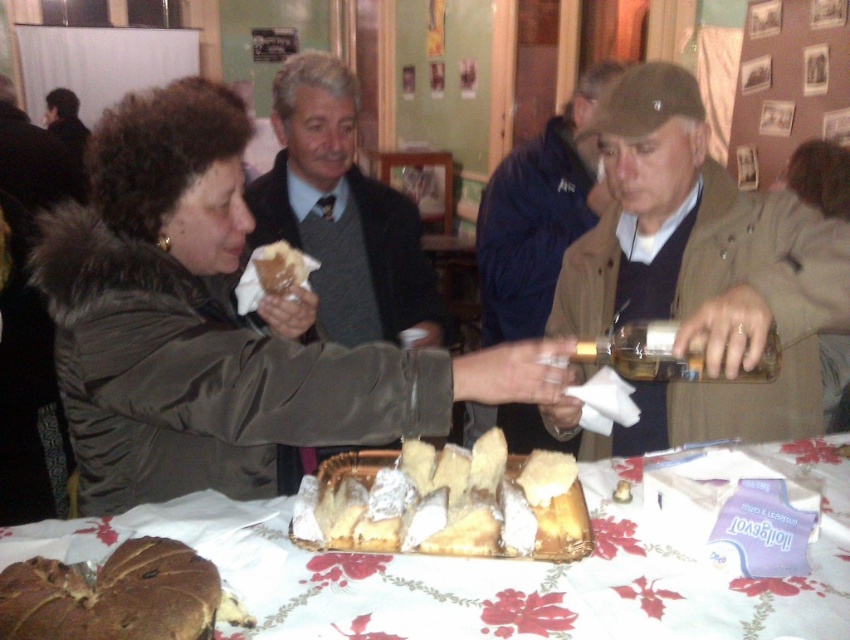
You are a guest at this event and want to reach for the translucent glass bottle at center without moving the brown crumbly pastry at lower left. Is this possible?

The brown crumbly pastry at lower left is in front of the translucent glass bottle at center, so you can reach the translucent glass bottle at center without moving the pastry by accessing it from behind.

You are at the point marked as point (140, 582) and want to walk towards the point marked as point (629, 368). Will you be moving away from the table covered by a white tablecloth with red floral patterns?

Point (140, 582) is in front of point (629, 368), so moving towards point (629, 368) would mean moving away from the table covered by a white tablecloth with red floral patterns.

You are a photographer standing at the back of the room. You want to take a photo of the matte green jacket at left and the white floral tablecloth at lower center so that both are clearly visible in the frame. Given their distance apart, is this possible?

The matte green jacket at left and the white floral tablecloth at lower center are 24.16 centimeters apart from each other. Since they are relatively close, it should be possible to capture both in a single frame as long as the camera is positioned appropriately to include both elements within the shot.